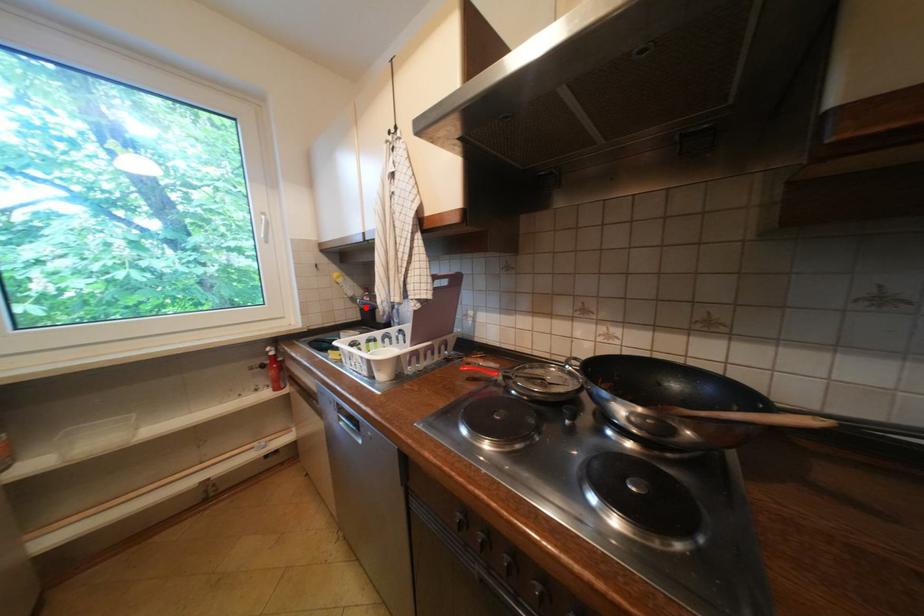
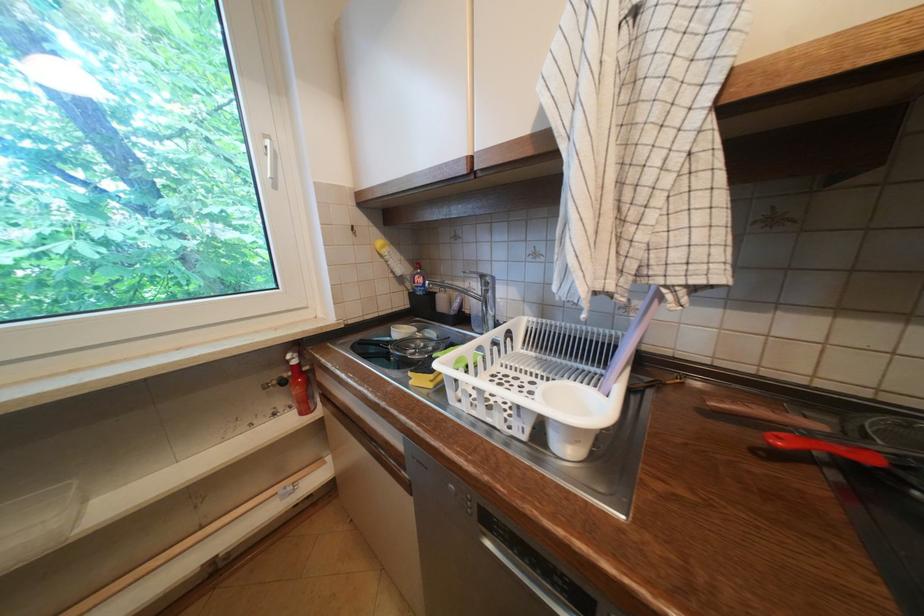
Find the pixel in the second image that matches the highlighted location in the first image.

(412, 291)